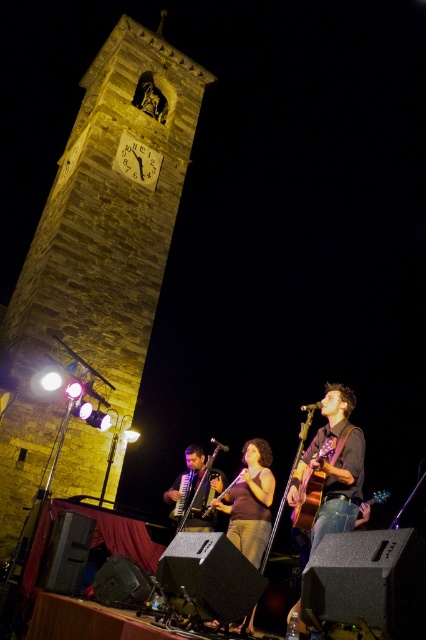
You are standing in the nighttime scene and want to take a photo of the stone clock tower at upper left. The camera you are using has a maximum focus range of 40 meters. Will you be able to focus on the tower?

The stone clock tower at upper left is 39.43 meters away from the viewer. Since the camera can focus up to 40 meters, you can focus on the tower as the distance is within the camera range.

What object is located at the coordinates point (x=97, y=266) in the image?

The point (x=97, y=266) corresponds to the stone clock tower at upper left.